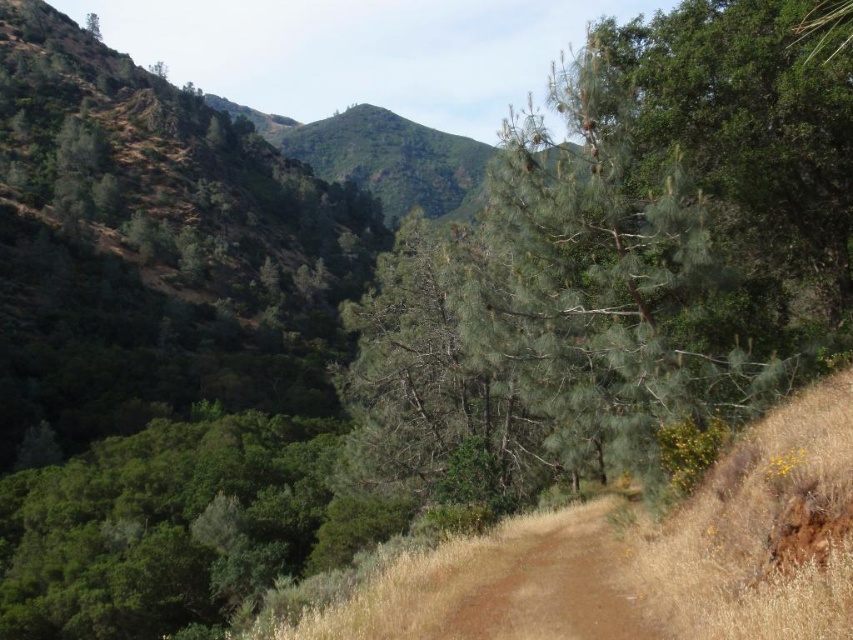
Is the position of green needle-like at center more distant than that of brown dirt track at center?

No, green needle-like at center is closer to the viewer.

Does green needle-like at center have a larger size compared to brown dirt track at center?

Correct, green needle-like at center is larger in size than brown dirt track at center.

Where is `green needle-like at center`? The height and width of the screenshot is (640, 853). green needle-like at center is located at coordinates (621, 264).

Locate an element on the screen. This screenshot has width=853, height=640. green needle-like at center is located at coordinates (621, 264).